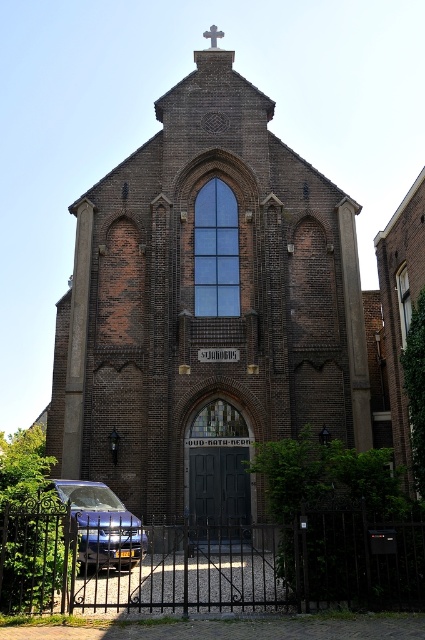
Does satin blue car at lower left have a larger size compared to white stone cross at upper center?

Actually, satin blue car at lower left might be smaller than white stone cross at upper center.

Can you confirm if satin blue car at lower left is taller than white stone cross at upper center?

Incorrect, satin blue car at lower left's height is not larger of white stone cross at upper center's.

Locate an element on the screen. The height and width of the screenshot is (640, 425). satin blue car at lower left is located at coordinates (102, 525).

Between brown brick chapel at center and satin blue car at lower left, which one appears on the right side from the viewer's perspective?

Positioned to the right is brown brick chapel at center.

What do you see at coordinates (206, 308) in the screenshot? I see `brown brick chapel at center` at bounding box center [206, 308].

Where is `brown brick chapel at center`? The image size is (425, 640). brown brick chapel at center is located at coordinates pyautogui.click(x=206, y=308).

Is point (218, 157) in front of point (217, 35)?

Yes, point (218, 157) is in front of point (217, 35).

Is brown brick chapel at center to the right of white stone cross at upper center from the viewer's perspective?

Yes, brown brick chapel at center is to the right of white stone cross at upper center.

Locate an element on the screen. This screenshot has height=640, width=425. brown brick chapel at center is located at coordinates (206, 308).